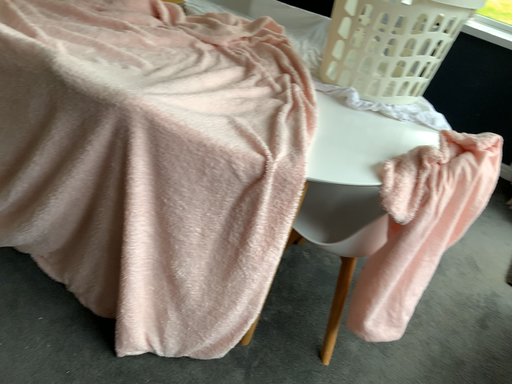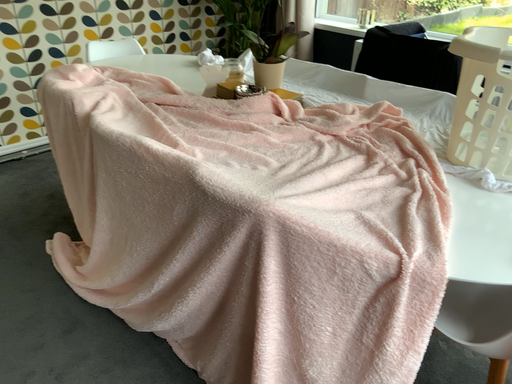
Question: Which way did the camera rotate in the video?

Choices:
 (A) rotated right
 (B) rotated left

Answer: (B)